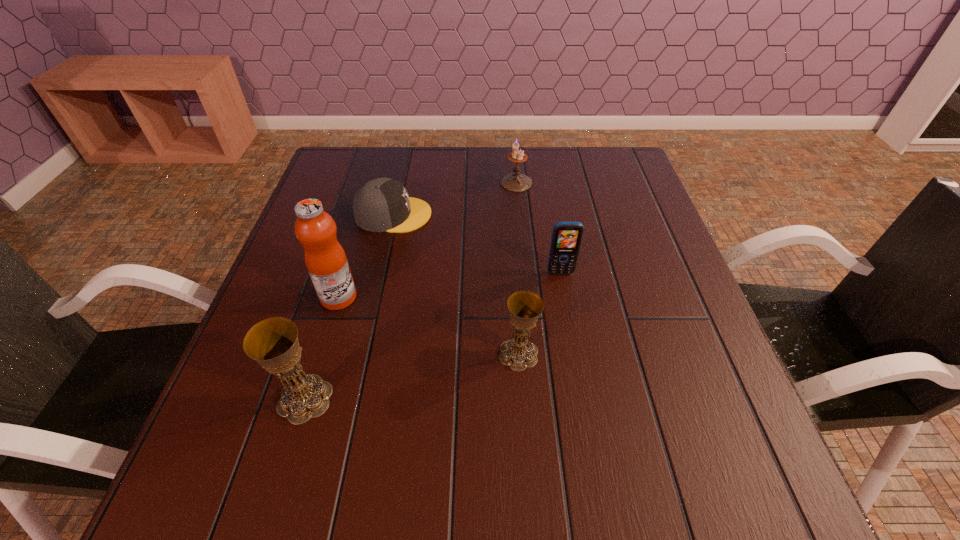
Identify the location of vacant area that satisfies the following two spatial constraints: 1. on the back side of the shorter chalice; 2. on the front-facing side of the fifth nearest object. [509, 214].

You are a GUI agent. You are given a task and a screenshot of the screen. Output one action in this format:
    pyautogui.click(x=<x>, y=<y>)
    Task: Click on the vacant space that satisfies the following two spatial constraints: 1. on the front-facing side of the shortest object; 2. on the back side of the right chalice
    The height and width of the screenshot is (540, 960).
    Given the screenshot: What is the action you would take?
    (x=363, y=354)